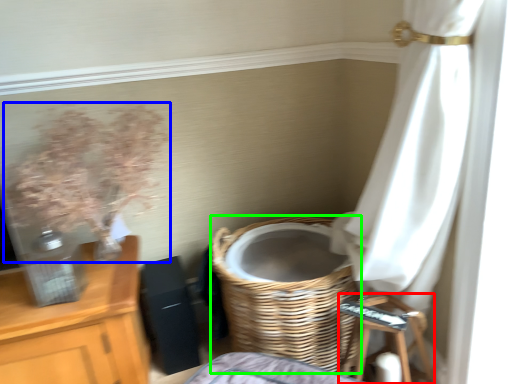
Question: Considering the real-world distances, which object is farthest from step stool (highlighted by a red box)? floral arrangement (highlighted by a blue box) or basket (highlighted by a green box)?

Choices:
 (A) floral arrangement
 (B) basket

Answer: (A)